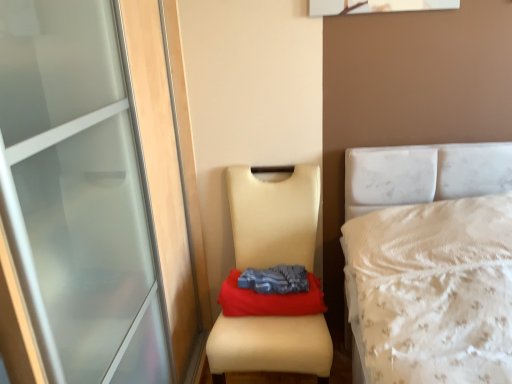
Question: Could you tell me if blue fabric at center is facing beige leather chair at center?

Choices:
 (A) yes
 (B) no

Answer: (A)

Question: Can you confirm if blue fabric at center is taller than beige leather chair at center?

Choices:
 (A) yes
 (B) no

Answer: (B)

Question: From the image's perspective, is blue fabric at center on beige leather chair at center?

Choices:
 (A) yes
 (B) no

Answer: (A)

Question: Does blue fabric at center have a greater width compared to beige leather chair at center?

Choices:
 (A) no
 (B) yes

Answer: (A)

Question: Could beige leather chair at center be considered to be inside blue fabric at center?

Choices:
 (A) yes
 (B) no

Answer: (B)

Question: Is beige leather chair at center at the back of blue fabric at center?

Choices:
 (A) no
 (B) yes

Answer: (B)

Question: Is beige leather chair at center thinner than blue fabric at center?

Choices:
 (A) yes
 (B) no

Answer: (B)

Question: Does beige leather chair at center appear on the left side of blue fabric at center?

Choices:
 (A) no
 (B) yes

Answer: (B)

Question: Considering the relative sizes of beige leather chair at center and blue fabric at center in the image provided, is beige leather chair at center bigger than blue fabric at center?

Choices:
 (A) yes
 (B) no

Answer: (A)

Question: Is blue fabric at center a part of beige leather chair at center?

Choices:
 (A) no
 (B) yes

Answer: (B)

Question: Can you confirm if beige leather chair at center is shorter than blue fabric at center?

Choices:
 (A) no
 (B) yes

Answer: (A)

Question: Considering the relative sizes of beige leather chair at center and blue fabric at center in the image provided, is beige leather chair at center smaller than blue fabric at center?

Choices:
 (A) no
 (B) yes

Answer: (A)

Question: Is beige leather chair at center aimed at blue fabric at center?

Choices:
 (A) yes
 (B) no

Answer: (A)